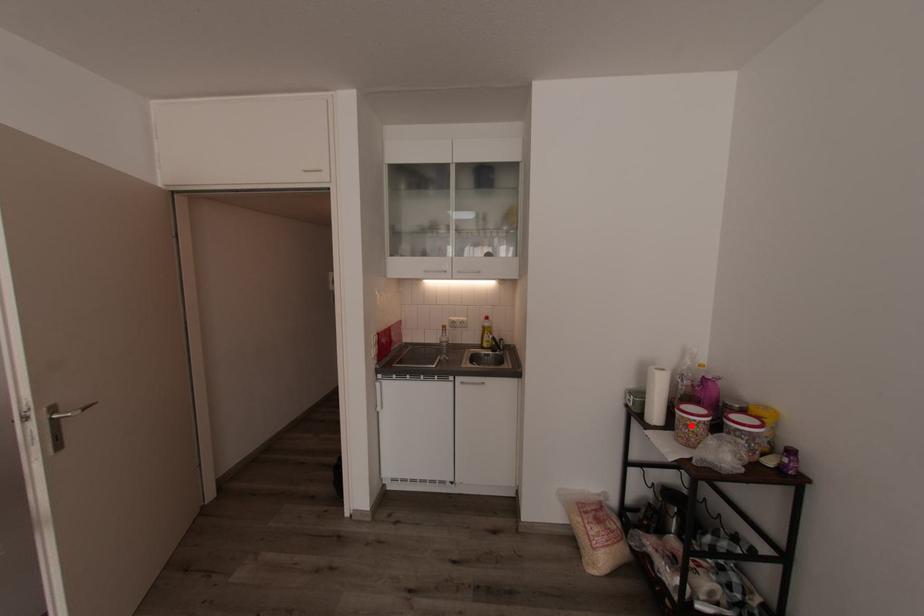
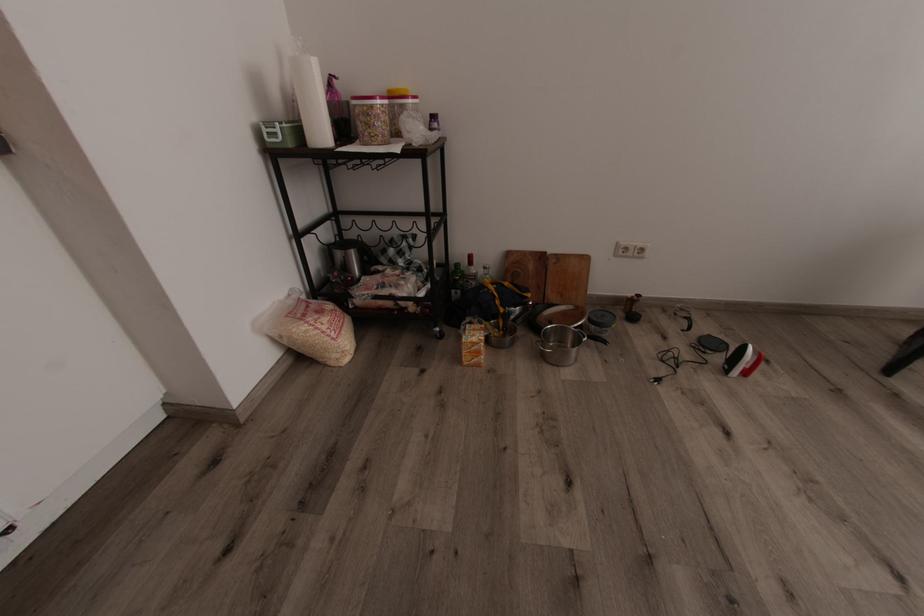
Where in the second image is the point corresponding to the highlighted location from the first image?

(382, 116)